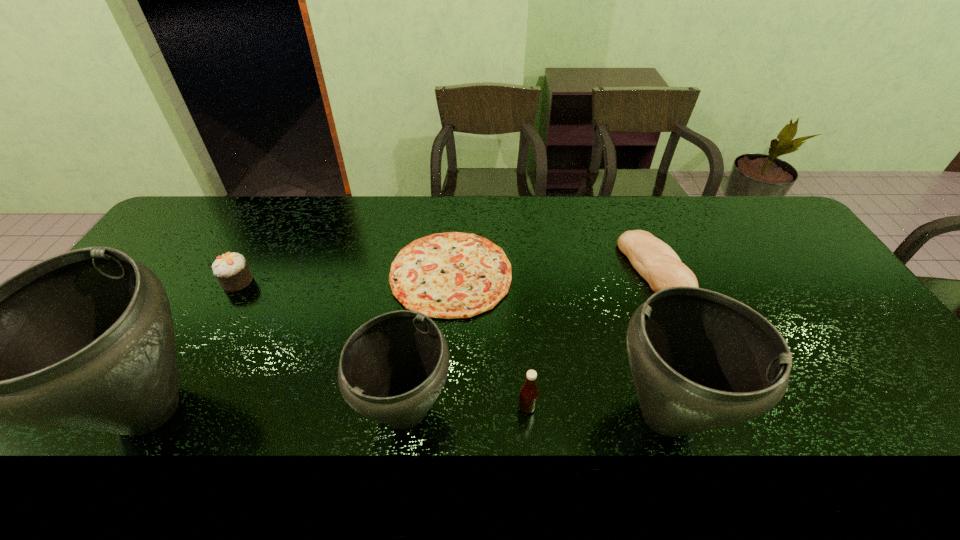
The width and height of the screenshot is (960, 540). I want to click on object located in the left edge section of the desktop, so click(x=84, y=340).

Image resolution: width=960 pixels, height=540 pixels. I want to click on object at the near left corner, so click(x=84, y=340).

The width and height of the screenshot is (960, 540). I want to click on vacant space at the far edge, so click(608, 233).

The height and width of the screenshot is (540, 960). I want to click on vacant area at the near edge of the desktop, so click(x=592, y=391).

Where is `unoccupied position between the tallest urn and the Tabasco sauce`? The width and height of the screenshot is (960, 540). unoccupied position between the tallest urn and the Tabasco sauce is located at coordinates (337, 409).

At what (x,y) coordinates should I click in order to perform the action: click on free space that is in between the tallest object and the fifth tallest object. Please return your answer as a coordinate pair (x, y). This screenshot has height=540, width=960. Looking at the image, I should click on (193, 345).

This screenshot has width=960, height=540. Identify the location of vacant area that lies between the Tabasco sauce and the second tallest urn. (597, 411).

The width and height of the screenshot is (960, 540). Find the location of `free space between the sixth tallest object and the shortest object`. free space between the sixth tallest object and the shortest object is located at coordinates (553, 272).

Where is `free space between the second tallest urn and the fifth tallest object`? free space between the second tallest urn and the fifth tallest object is located at coordinates (452, 348).

You are a GUI agent. You are given a task and a screenshot of the screen. Output one action in this format:
    pyautogui.click(x=<x>, y=<y>)
    Task: Click on the empty space that is in between the second tallest urn and the cupcake
    The image size is (960, 540).
    Given the screenshot: What is the action you would take?
    pyautogui.click(x=452, y=348)